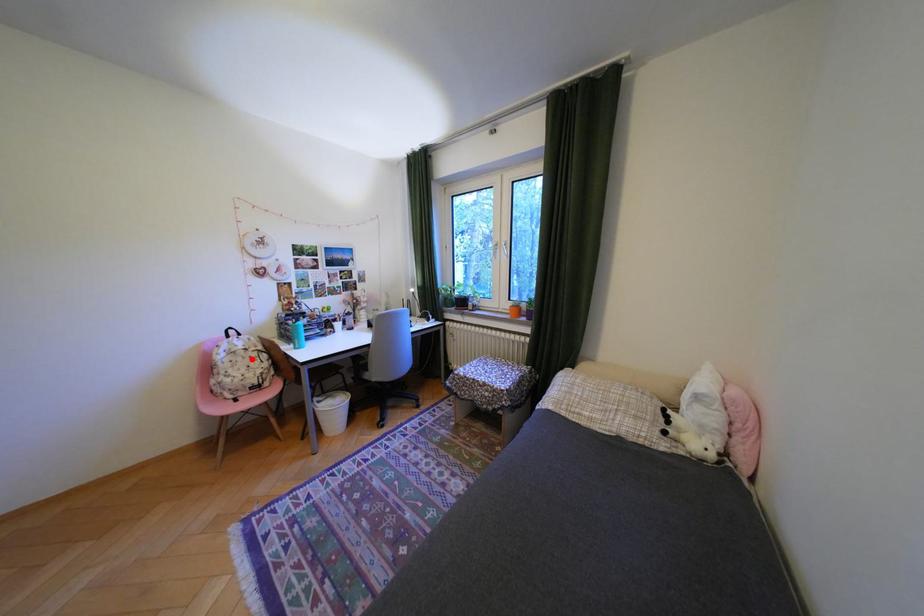
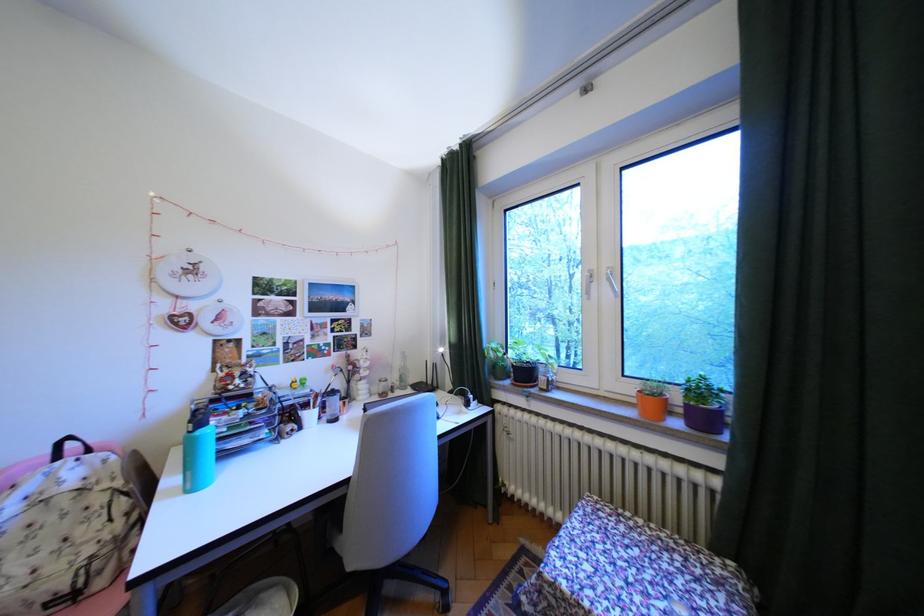
Question: I am providing you with two images of the same scene from different viewpoints. Given a red point in image1, look at the same physical point in image2. Is it:

Choices:
 (A) Closer to the viewpoint
 (B) Farther from the viewpoint

Answer: (A)